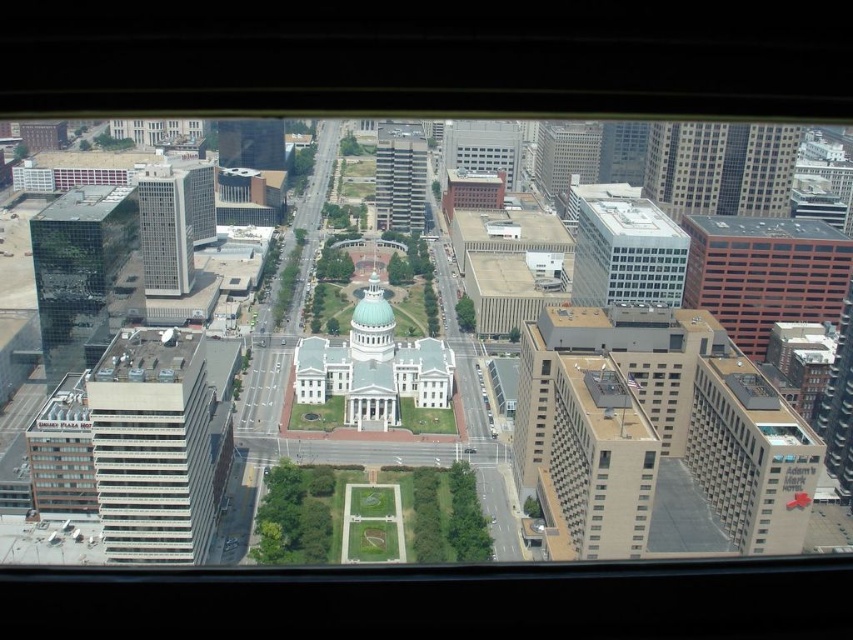
You are standing on a balcony overlooking the city. You notice a point at coordinates (154, 445). What does this point indicate?

The point at coordinates (154, 445) corresponds to the white glass building at left.

You are an urban planner reviewing the city layout. You need to determine which of the two buildings, the white glass building at upper right or the glassy reflective skyscraper at upper left, requires more space for construction. Based on their sizes, which one would need a larger plot of land?

The glassy reflective skyscraper at upper left requires a larger plot of land because it is bigger than the white glass building at upper right.